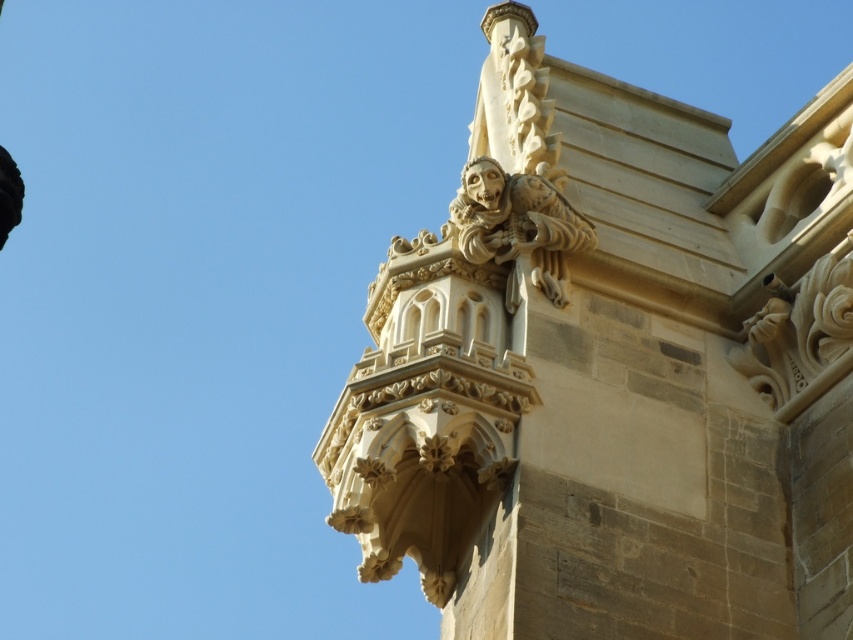
Does point (849, 608) come farther from viewer compared to point (563, 291)?

No, (849, 608) is in front of (563, 291).

Locate an element on the screen. The height and width of the screenshot is (640, 853). beige stone gargoyle at upper right is located at coordinates (613, 371).

Is point (544, 122) farther from camera compared to point (570, 216)?

Yes.

The height and width of the screenshot is (640, 853). Find the location of `beige stone gargoyle at upper right`. beige stone gargoyle at upper right is located at coordinates (613, 371).